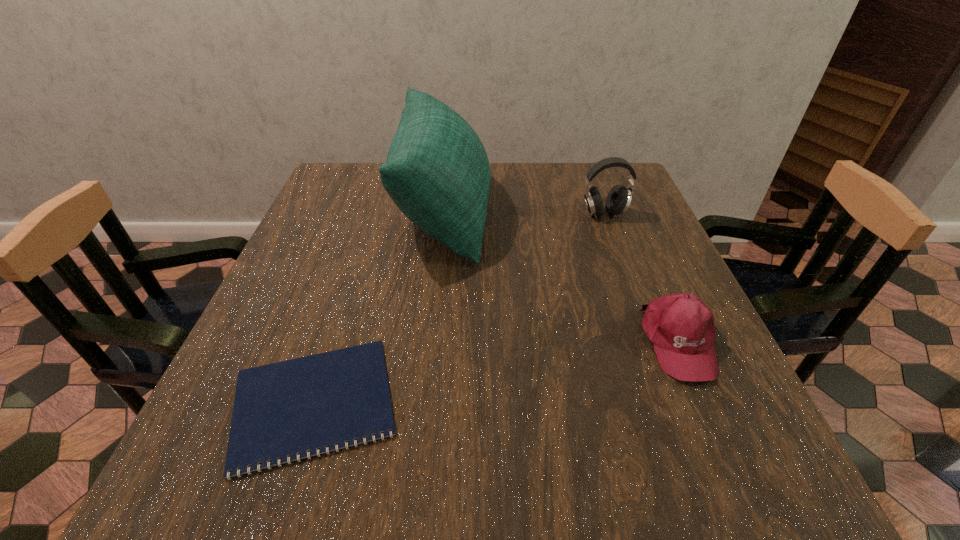
Where is `object present at the near edge`? The image size is (960, 540). object present at the near edge is located at coordinates (288, 408).

I want to click on object situated at the left edge, so click(x=288, y=408).

I want to click on headset present at the right edge, so click(x=618, y=200).

The height and width of the screenshot is (540, 960). I want to click on baseball cap present at the right edge, so click(x=681, y=328).

Identify the location of object positioned at the near left corner. Image resolution: width=960 pixels, height=540 pixels. (288, 408).

Identify the location of object located in the far right corner section of the desktop. (618, 200).

This screenshot has width=960, height=540. What are the coordinates of `free space at the far edge` in the screenshot? It's located at (564, 168).

I want to click on vacant region at the near edge of the desktop, so click(x=556, y=444).

Where is `vacant space at the left edge of the desktop`? The height and width of the screenshot is (540, 960). vacant space at the left edge of the desktop is located at coordinates point(334,317).

Image resolution: width=960 pixels, height=540 pixels. In order to click on free space at the right edge of the desktop in this screenshot , I will do coord(715,390).